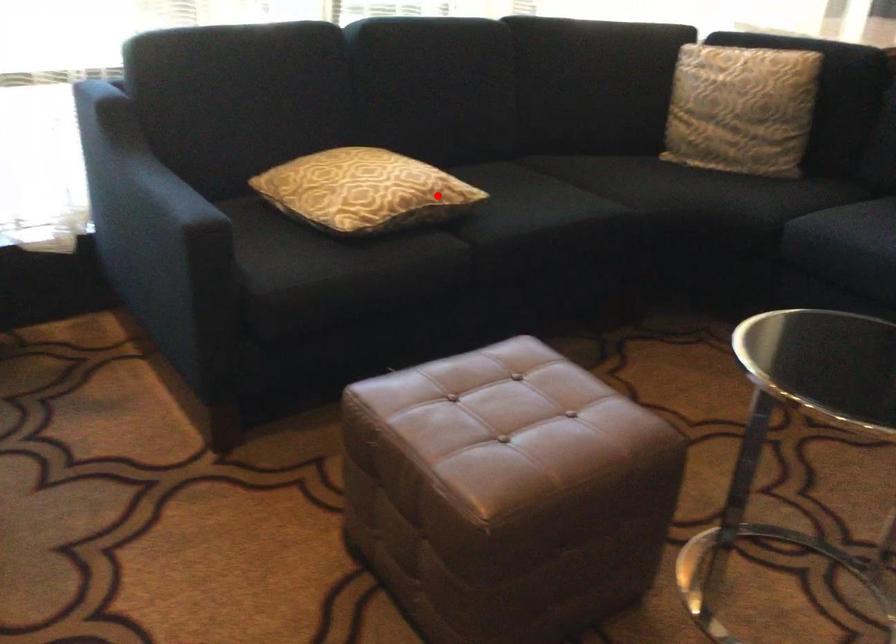
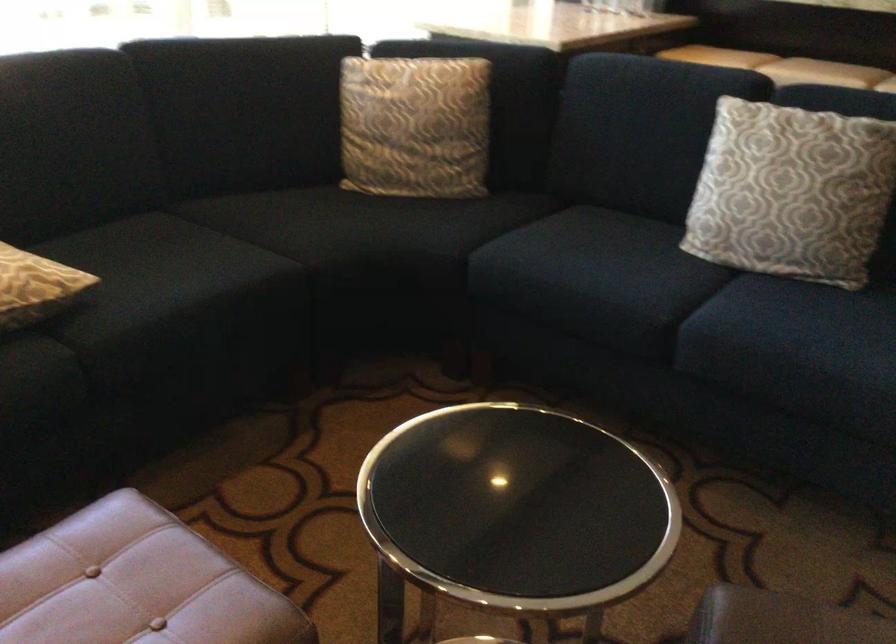
Locate, in the second image, the point that corresponds to the highlighted location in the first image.

(35, 287)